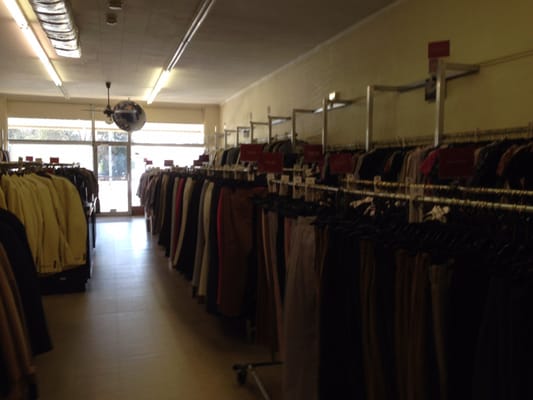
Find the location of a particular element. This screenshot has height=400, width=533. glass is located at coordinates (120, 166).